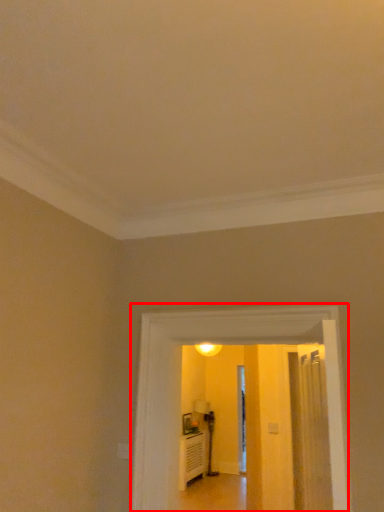
Question: Where is corridor (annotated by the red box) located in relation to path in the image?

Choices:
 (A) left
 (B) right

Answer: (A)